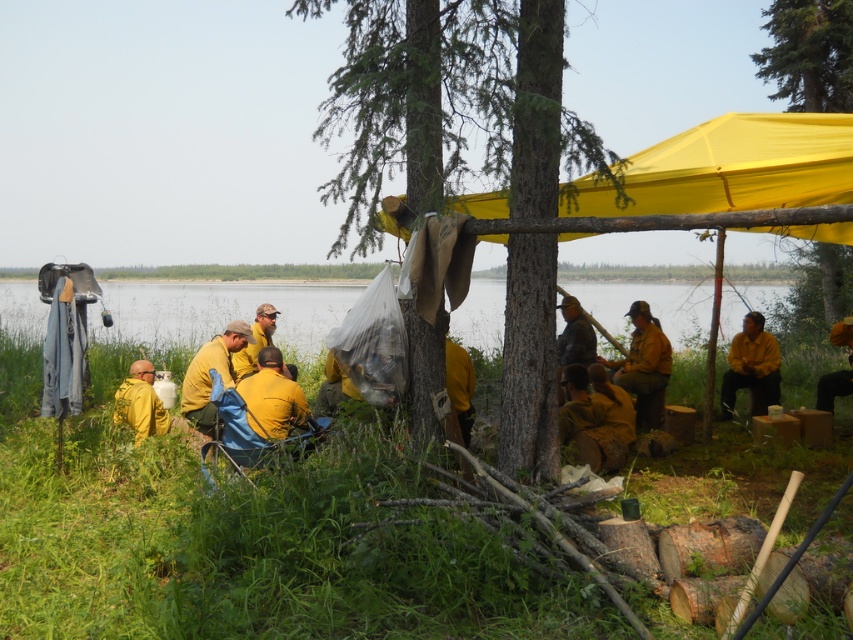
Where is `green rough bark tree at upper right`? The image size is (853, 640). green rough bark tree at upper right is located at coordinates (808, 52).

Is green rough bark tree at upper right to the left of yellow fire-resistant uniform at center from the viewer's perspective?

Incorrect, green rough bark tree at upper right is not on the left side of yellow fire-resistant uniform at center.

Is point (817, 45) positioned in front of point (202, 394)?

No, it is not.

Identify the location of green rough bark tree at upper right. Image resolution: width=853 pixels, height=640 pixels. (808, 52).

Is yellow matte uniform at center taller than brown leather jacket at center?

No, yellow matte uniform at center is not taller than brown leather jacket at center.

I want to click on yellow matte uniform at center, so click(273, 397).

Between smooth bark tree at center and brown leather jacket at center, which one is positioned lower?

brown leather jacket at center

What do you see at coordinates (451, 106) in the screenshot?
I see `smooth bark tree at center` at bounding box center [451, 106].

You are a GUI agent. You are given a task and a screenshot of the screen. Output one action in this format:
    pyautogui.click(x=<x>, y=<y>)
    Task: Click on the smooth bark tree at center
    The image size is (853, 640).
    Given the screenshot: What is the action you would take?
    pyautogui.click(x=451, y=106)